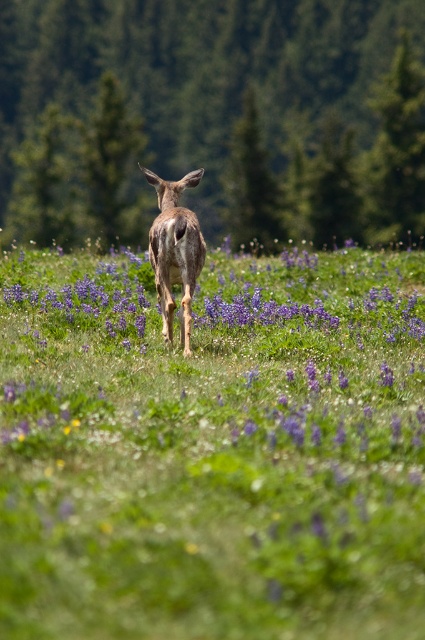
Question: Is green grassy field at center above shiny brown deer at center?

Choices:
 (A) yes
 (B) no

Answer: (B)

Question: Can you confirm if green grassy field at center is positioned below shiny brown deer at center?

Choices:
 (A) no
 (B) yes

Answer: (B)

Question: Can you confirm if green grassy field at center is positioned above shiny brown deer at center?

Choices:
 (A) no
 (B) yes

Answer: (A)

Question: Which of the following is the farthest from the observer?

Choices:
 (A) (180, 246)
 (B) (186, 422)

Answer: (A)